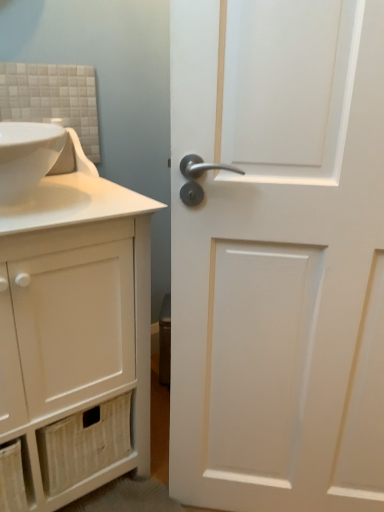
Question: Would you say white matte cabinet at left is part of white matte door at right's contents?

Choices:
 (A) yes
 (B) no

Answer: (B)

Question: From a real-world perspective, is white matte door at right on white matte cabinet at left?

Choices:
 (A) no
 (B) yes

Answer: (B)

Question: Is white matte door at right turned away from white matte cabinet at left?

Choices:
 (A) no
 (B) yes

Answer: (A)

Question: Is white matte door at right positioned before white matte cabinet at left?

Choices:
 (A) no
 (B) yes

Answer: (B)

Question: Is white matte door at right further to the viewer compared to white matte cabinet at left?

Choices:
 (A) no
 (B) yes

Answer: (A)

Question: Considering the relative sizes of white matte door at right and white matte cabinet at left in the image provided, is white matte door at right smaller than white matte cabinet at left?

Choices:
 (A) yes
 (B) no

Answer: (A)

Question: Does white matte door at right have a smaller size compared to white glossy sink at upper left?

Choices:
 (A) yes
 (B) no

Answer: (B)

Question: Is white matte door at right thinner than white glossy sink at upper left?

Choices:
 (A) no
 (B) yes

Answer: (B)

Question: From a real-world perspective, is white matte door at right physically above white glossy sink at upper left?

Choices:
 (A) yes
 (B) no

Answer: (B)

Question: Would you say white glossy sink at upper left is part of white matte door at right's contents?

Choices:
 (A) no
 (B) yes

Answer: (A)

Question: Is white matte door at right closer to camera compared to white glossy sink at upper left?

Choices:
 (A) no
 (B) yes

Answer: (B)

Question: Is white matte door at right bigger than white glossy sink at upper left?

Choices:
 (A) yes
 (B) no

Answer: (A)

Question: Does white glossy sink at upper left have a larger size compared to white matte door at right?

Choices:
 (A) no
 (B) yes

Answer: (A)